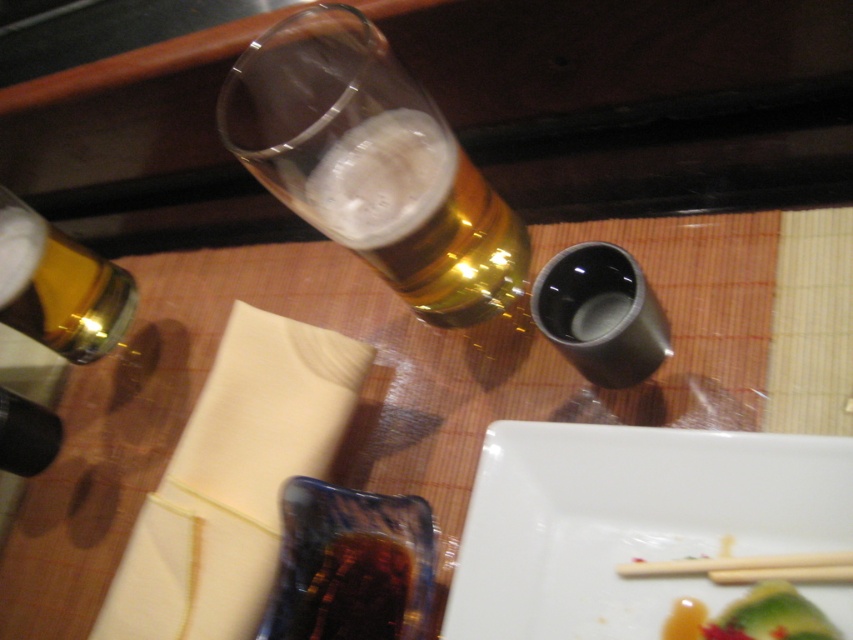
Question: Is gold metallic bottle at upper left bigger than wooden chopsticks at lower right?

Choices:
 (A) yes
 (B) no

Answer: (A)

Question: Is green leafy vegetable at lower right in front of wooden chopsticks at lower right?

Choices:
 (A) yes
 (B) no

Answer: (A)

Question: Which is nearer to the golden glass beer at upper center?

Choices:
 (A) green leafy vegetable at lower right
 (B) gold metallic bottle at upper left
 (C) wooden chopsticks at lower right
 (D) white glossy plate at lower right

Answer: (D)

Question: Estimate the real-world distances between objects in this image. Which object is closer to the white glossy plate at lower right?

Choices:
 (A) gold metallic bottle at upper left
 (B) golden glass beer at upper center

Answer: (B)

Question: Is green leafy vegetable at lower right to the right of wooden chopsticks at lower right from the viewer's perspective?

Choices:
 (A) yes
 (B) no

Answer: (A)

Question: Which of the following is the closest to the observer?

Choices:
 (A) (80, 292)
 (B) (387, 278)
 (C) (773, 630)

Answer: (C)